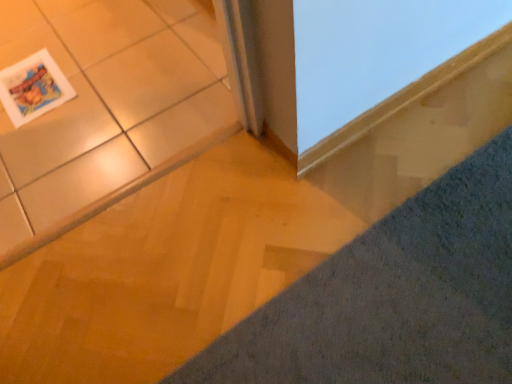
What is the approximate height of matte ceramic tile at upper left?

The height of matte ceramic tile at upper left is 1.93 inches.

What is the approximate height of matte paper magazine at upper left?

matte paper magazine at upper left is 0.79 inches tall.

What is the approximate width of matte paper magazine at upper left?

matte paper magazine at upper left is 11.78 inches in width.

You are a GUI agent. You are given a task and a screenshot of the screen. Output one action in this format:
    pyautogui.click(x=<x>, y=<y>)
    Task: Click on the gray textured carpet at lower right
    The image size is (512, 384).
    Given the screenshot: What is the action you would take?
    pyautogui.click(x=393, y=297)

Which of these two, smooth wood frame at upper right or matte ceramic tile at upper left, is thinner?

With smaller width is smooth wood frame at upper right.

Find the location of `ceramic tile in front of the smooth wood frame at upper right`. ceramic tile in front of the smooth wood frame at upper right is located at coordinates (111, 112).

Based on the photo, from a real-world perspective, who is located higher, smooth wood frame at upper right or matte ceramic tile at upper left?

smooth wood frame at upper right is physically above.

Which is in front, smooth wood frame at upper right or matte ceramic tile at upper left?

matte ceramic tile at upper left is in front.

At what (x,y) coordinates should I click in order to perform the action: click on ceramic tile lying above the matte paper magazine at upper left (from the image's perspective). Please return your answer as a coordinate pair (x, y). This screenshot has height=384, width=512. Looking at the image, I should click on (111, 112).

Is matte ceramic tile at upper left taller than matte paper magazine at upper left?

Indeed, matte ceramic tile at upper left has a greater height compared to matte paper magazine at upper left.

Is point (30, 96) closer to viewer compared to point (462, 276)?

That is False.

Can you confirm if matte paper magazine at upper left is positioned to the right of gray textured carpet at lower right?

No.

Would you say matte paper magazine at upper left is a long distance from gray textured carpet at lower right?

Absolutely, matte paper magazine at upper left is distant from gray textured carpet at lower right.

From the image's perspective, which is above, matte paper magazine at upper left or gray textured carpet at lower right?

From the image's view, matte paper magazine at upper left is above.

Does gray textured carpet at lower right contain smooth wood frame at upper right?

No, smooth wood frame at upper right is not surrounded by gray textured carpet at lower right.

Can you tell me how much gray textured carpet at lower right and smooth wood frame at upper right differ in facing direction?

There is a 180-degree angle between the facing directions of gray textured carpet at lower right and smooth wood frame at upper right.

Is gray textured carpet at lower right taller or shorter than smooth wood frame at upper right?

Considering their sizes, gray textured carpet at lower right has less height than smooth wood frame at upper right.

Based on the photo, considering the relative positions of gray textured carpet at lower right and smooth wood frame at upper right in the image provided, is gray textured carpet at lower right to the left of smooth wood frame at upper right from the viewer's perspective?

Yes, gray textured carpet at lower right is to the left of smooth wood frame at upper right.

Is smooth wood frame at upper right wider or thinner than gray textured carpet at lower right?

In the image, smooth wood frame at upper right appears to be more narrow than gray textured carpet at lower right.

Does smooth wood frame at upper right contain gray textured carpet at lower right?

Definitely not — gray textured carpet at lower right is not inside smooth wood frame at upper right.

This screenshot has width=512, height=384. In order to click on window that appears on the right of gray textured carpet at lower right in this screenshot , I will do `click(375, 51)`.

From a real-world perspective, is smooth wood frame at upper right below gray textured carpet at lower right?

No.

Visually, is matte ceramic tile at upper left positioned to the left or to the right of smooth wood frame at upper right?

In the image, matte ceramic tile at upper left appears on the left side of smooth wood frame at upper right.

Does matte ceramic tile at upper left come behind smooth wood frame at upper right?

No, matte ceramic tile at upper left is closer to the camera.

How much distance is there between matte ceramic tile at upper left and smooth wood frame at upper right?

matte ceramic tile at upper left is 23.09 inches away from smooth wood frame at upper right.

Consider the image. Who is taller, matte ceramic tile at upper left or smooth wood frame at upper right?

smooth wood frame at upper right.

What's the angular difference between matte paper magazine at upper left and matte ceramic tile at upper left's facing directions?

0.122 degrees.

Could you tell me if matte paper magazine at upper left is turned towards matte ceramic tile at upper left?

Yes, matte paper magazine at upper left is aimed at matte ceramic tile at upper left.

Is point (21, 75) positioned after point (102, 51)?

No, (21, 75) is closer to viewer.

Which is more to the left, matte paper magazine at upper left or matte ceramic tile at upper left?

matte paper magazine at upper left.

Identify the location of window that appears below the matte ceramic tile at upper left (from the image's perspective). Image resolution: width=512 pixels, height=384 pixels. (375, 51).

This screenshot has height=384, width=512. What are the coordinates of `magazine that appears above the matte ceramic tile at upper left (from a real-world perspective)` in the screenshot? It's located at (33, 88).

Which object lies further to the anchor point smooth wood frame at upper right, matte paper magazine at upper left or gray textured carpet at lower right?

Among the two, matte paper magazine at upper left is located further to smooth wood frame at upper right.

From the image, which object appears to be farther from matte ceramic tile at upper left, smooth wood frame at upper right or gray textured carpet at lower right?

gray textured carpet at lower right.

When comparing their distances from gray textured carpet at lower right, does matte ceramic tile at upper left or smooth wood frame at upper right seem closer?

The object closer to gray textured carpet at lower right is smooth wood frame at upper right.

Based on their spatial positions, is smooth wood frame at upper right or matte paper magazine at upper left closer to matte ceramic tile at upper left?

The object closer to matte ceramic tile at upper left is matte paper magazine at upper left.

Looking at the image, which one is located further to matte paper magazine at upper left, smooth wood frame at upper right or gray textured carpet at lower right?

gray textured carpet at lower right is positioned further to the anchor matte paper magazine at upper left.

Estimate the real-world distances between objects in this image. Which object is closer to matte paper magazine at upper left, gray textured carpet at lower right or matte ceramic tile at upper left?

Among the two, matte ceramic tile at upper left is located nearer to matte paper magazine at upper left.

Based on their spatial positions, is smooth wood frame at upper right or matte ceramic tile at upper left further from gray textured carpet at lower right?

matte ceramic tile at upper left is further to gray textured carpet at lower right.

When comparing their distances from gray textured carpet at lower right, does smooth wood frame at upper right or matte paper magazine at upper left seem further?

The object further to gray textured carpet at lower right is matte paper magazine at upper left.

The image size is (512, 384). I want to click on ceramic tile situated between matte paper magazine at upper left and smooth wood frame at upper right from left to right, so click(111, 112).

Where is `ceramic tile between matte paper magazine at upper left and gray textured carpet at lower right in the horizontal direction`? Image resolution: width=512 pixels, height=384 pixels. ceramic tile between matte paper magazine at upper left and gray textured carpet at lower right in the horizontal direction is located at coordinates (111, 112).

Find the location of a particular element. The width and height of the screenshot is (512, 384). concrete situated between matte ceramic tile at upper left and smooth wood frame at upper right from left to right is located at coordinates (393, 297).

I want to click on concrete between matte paper magazine at upper left and smooth wood frame at upper right, so click(x=393, y=297).